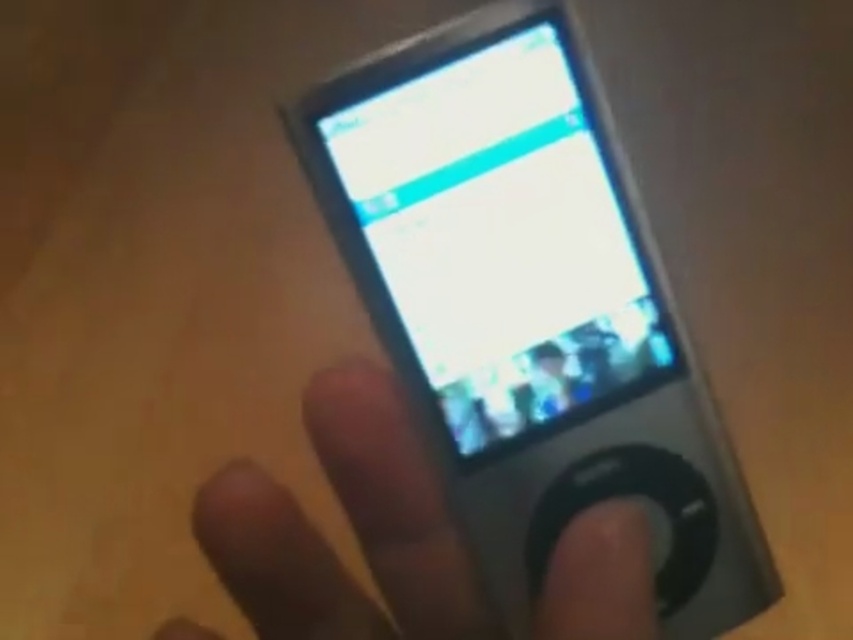
Question: Is satin silver ipod at center above satin silver phone at center?

Choices:
 (A) no
 (B) yes

Answer: (B)

Question: Is satin silver ipod at center positioned in front of satin silver phone at center?

Choices:
 (A) yes
 (B) no

Answer: (B)

Question: Is satin silver ipod at center to the right of satin silver phone at center from the viewer's perspective?

Choices:
 (A) yes
 (B) no

Answer: (A)

Question: Which of the following is the farthest from the observer?

Choices:
 (A) satin silver phone at center
 (B) satin silver ipod at center

Answer: (B)

Question: Which of the following is the farthest from the observer?

Choices:
 (A) satin silver ipod at center
 (B) satin silver phone at center

Answer: (A)